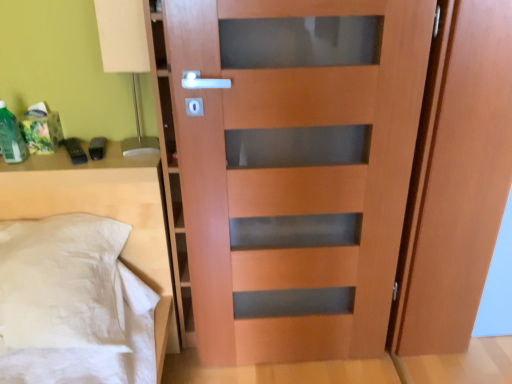
Image resolution: width=512 pixels, height=384 pixels. Identify the location of empty space that is ontop of white fabric pillow at left (from a real-world perspective). (75, 151).